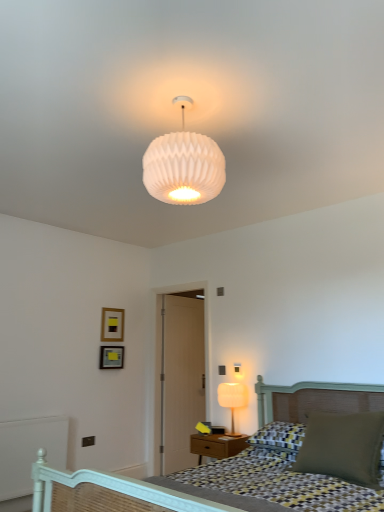
Question: Is the surface of white painted wood balustrade at lower left in direct contact with white ribbed glass lampshade at upper center, which is the second lamp from bottom to top?

Choices:
 (A) no
 (B) yes

Answer: (A)

Question: From the image's perspective, would you say white painted wood balustrade at lower left is shown under white ribbed glass lampshade at upper center, the first lamp when ordered from front to back?

Choices:
 (A) yes
 (B) no

Answer: (A)

Question: Is white painted wood balustrade at lower left not near white ribbed glass lampshade at upper center, the second lamp viewed from the back?

Choices:
 (A) no
 (B) yes

Answer: (B)

Question: Is white painted wood balustrade at lower left closer to camera compared to white ribbed glass lampshade at upper center, acting as the first lamp starting from the top?

Choices:
 (A) no
 (B) yes

Answer: (A)

Question: Does white painted wood balustrade at lower left have a larger size compared to white ribbed glass lampshade at upper center, which is the second lamp from bottom to top?

Choices:
 (A) no
 (B) yes

Answer: (A)

Question: Does white painted wood balustrade at lower left have a smaller size compared to white ribbed glass lampshade at upper center, the second lamp viewed from the back?

Choices:
 (A) yes
 (B) no

Answer: (A)

Question: From the image's perspective, is matte green pillow at lower right over white ribbed glass lampshade at upper center, marked as the 2th lamp in a right-to-left arrangement?

Choices:
 (A) yes
 (B) no

Answer: (B)

Question: Is matte green pillow at lower right directly adjacent to white ribbed glass lampshade at upper center, the first lamp when ordered from front to back?

Choices:
 (A) no
 (B) yes

Answer: (A)

Question: Is matte green pillow at lower right shorter than white ribbed glass lampshade at upper center, acting as the first lamp starting from the left?

Choices:
 (A) no
 (B) yes

Answer: (B)

Question: Is matte green pillow at lower right positioned beyond the bounds of white ribbed glass lampshade at upper center, which is the second lamp from bottom to top?

Choices:
 (A) no
 (B) yes

Answer: (B)

Question: Is the position of matte green pillow at lower right less distant than that of white ribbed glass lampshade at upper center, acting as the first lamp starting from the top?

Choices:
 (A) yes
 (B) no

Answer: (B)

Question: Considering the relative sizes of matte green pillow at lower right and white ribbed glass lampshade at upper center, acting as the first lamp starting from the top, in the image provided, is matte green pillow at lower right taller than white ribbed glass lampshade at upper center, acting as the first lamp starting from the top,?

Choices:
 (A) yes
 (B) no

Answer: (B)

Question: Does white ribbed glass lampshade at upper center, marked as the 2th lamp in a right-to-left arrangement, have a lesser width compared to matte black picture frame at upper left, which appears as the first picture frame when ordered from the bottom?

Choices:
 (A) no
 (B) yes

Answer: (A)